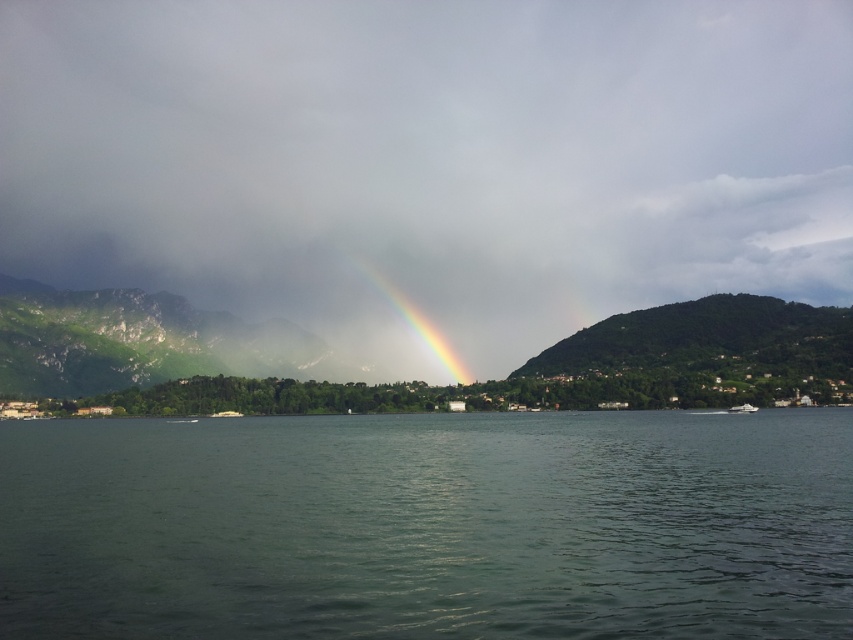
You are standing at the center of the image and looking towards the rainbow. Which direction should you turn to face the green textured mountain at center?

The green textured mountain at center is located at point coordinates of (422, 380). Since you are at the center, turning towards the direction of the coordinates would mean facing slightly to the right and upwards from the rainbow.

You are a photographer planning to capture the white glossy boat at lower right and the green textured mountain at center in the same frame. Given that the mountain is much taller than the boat, how might you position your camera to include both elements effectively?

Since the green textured mountain at center is much taller than the white glossy boat at lower right, positioning the camera lower to the ground would allow the mountain to dominate the upper portion of the frame while still capturing the boat at the lower right, ensuring both elements are included in the composition.